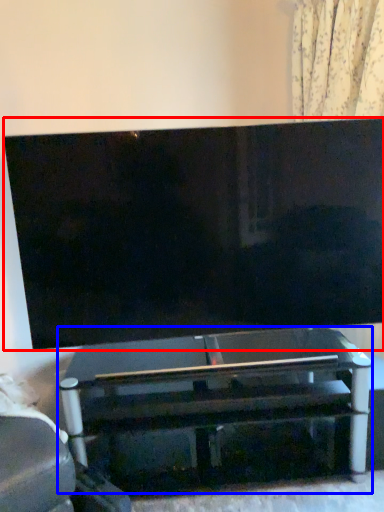
Question: Which point is closer to the camera, television (highlighted by a red box) or table (highlighted by a blue box)?

Choices:
 (A) television
 (B) table

Answer: (A)